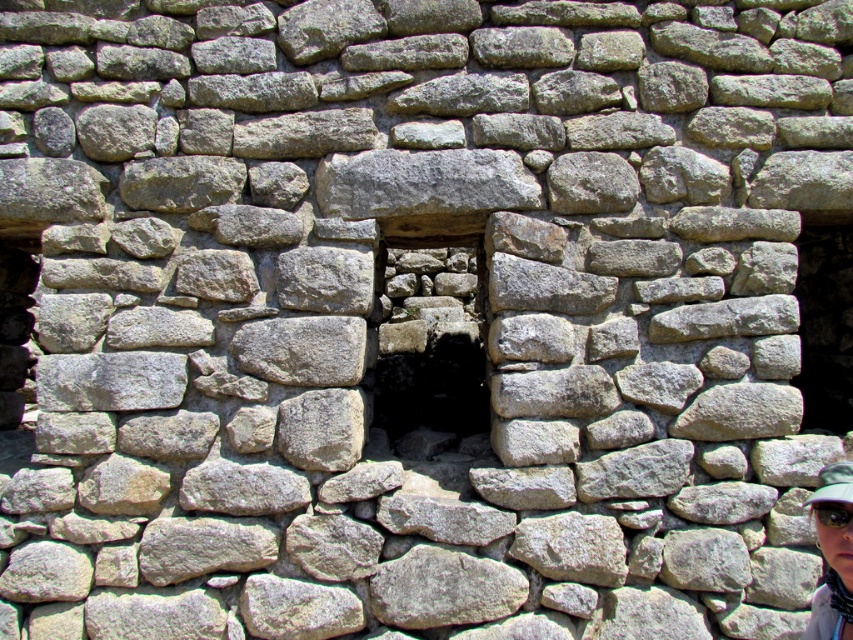
Question: Which point is farther to the camera?

Choices:
 (A) black fabric baseball cap at lower right
 (B) natural stone window at center
 (C) matte gray hat at lower right

Answer: (B)

Question: Does matte gray hat at lower right come in front of black fabric baseball cap at lower right?

Choices:
 (A) no
 (B) yes

Answer: (A)

Question: Where is natural stone window at center located in relation to matte gray hat at lower right in the image?

Choices:
 (A) below
 (B) above

Answer: (B)

Question: Is natural stone window at center below matte gray hat at lower right?

Choices:
 (A) yes
 (B) no

Answer: (B)

Question: Which object is positioned farthest from the matte gray hat at lower right?

Choices:
 (A) black fabric baseball cap at lower right
 (B) natural stone window at center

Answer: (B)

Question: Which object is the closest to the natural stone window at center?

Choices:
 (A) black fabric baseball cap at lower right
 (B) matte gray hat at lower right

Answer: (B)